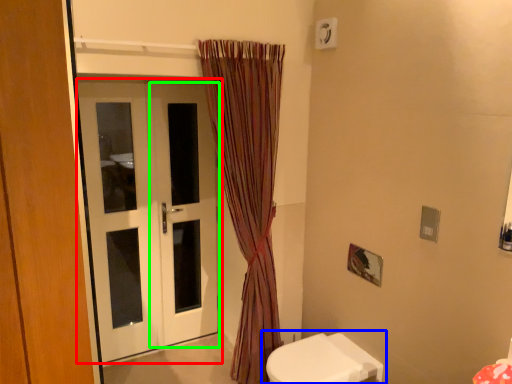
Question: Considering the real-world distances, which object is closest to door (highlighted by a red box)? toilet (highlighted by a blue box) or screen door (highlighted by a green box).

Choices:
 (A) toilet
 (B) screen door

Answer: (B)